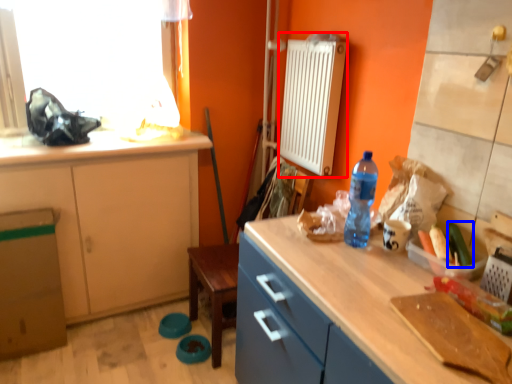
Question: Among these objects, which one is nearest to the camera, radiator (highlighted by a red box) or vegetable (highlighted by a blue box)?

Choices:
 (A) radiator
 (B) vegetable

Answer: (B)